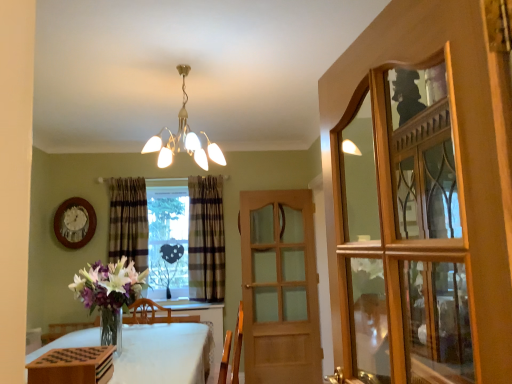
Question: From a real-world perspective, is plaid fabric curtain at center, which appears as the 2th curtain when viewed from the right, positioned above or below white cloth-covered table at lower left?

Choices:
 (A) below
 (B) above

Answer: (B)

Question: Relative to white cloth-covered table at lower left, is plaid fabric curtain at center, which is the 1th curtain in left-to-right order, in front or behind?

Choices:
 (A) front
 (B) behind

Answer: (B)

Question: Which object is positioned farthest from the wooden glass cabinet at right?

Choices:
 (A) clear glass heart at center
 (B) white cloth-covered table at lower left
 (C) wooden clock at upper left
 (D) light brown wooden door at center
 (E) plaid fabric curtain at center, the 2th curtain positioned from the left

Answer: (C)

Question: Which is nearer to the plaid fabric curtain at center, which is the 1th curtain in left-to-right order?

Choices:
 (A) light brown wooden door at center
 (B) plaid fabric curtain at center, which ranks as the 1th curtain in right-to-left order
 (C) clear glass heart at center
 (D) metallic chandelier at upper center
 (E) white cloth-covered table at lower left

Answer: (C)